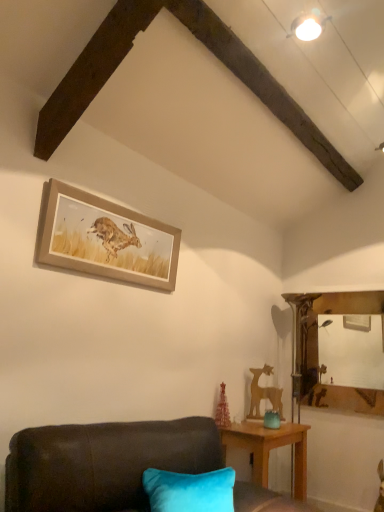
Question: Do you think wooden deer at right is within wooden framed print of hare at upper center, or outside of it?

Choices:
 (A) inside
 (B) outside

Answer: (B)

Question: From the image's perspective, is wooden deer at right positioned above or below wooden framed print of hare at upper center?

Choices:
 (A) above
 (B) below

Answer: (B)

Question: Which object is positioned closest to the wooden framed print of hare at upper center?

Choices:
 (A) wooden table at lower right
 (B) teal glass jar at lower right
 (C) velvet dark brown couch at lower left
 (D) wooden deer at right

Answer: (C)

Question: Based on their relative distances, which object is farther from the wooden table at lower right?

Choices:
 (A) velvet dark brown couch at lower left
 (B) wooden framed print of hare at upper center
 (C) wooden deer at right
 (D) teal glass jar at lower right

Answer: (B)